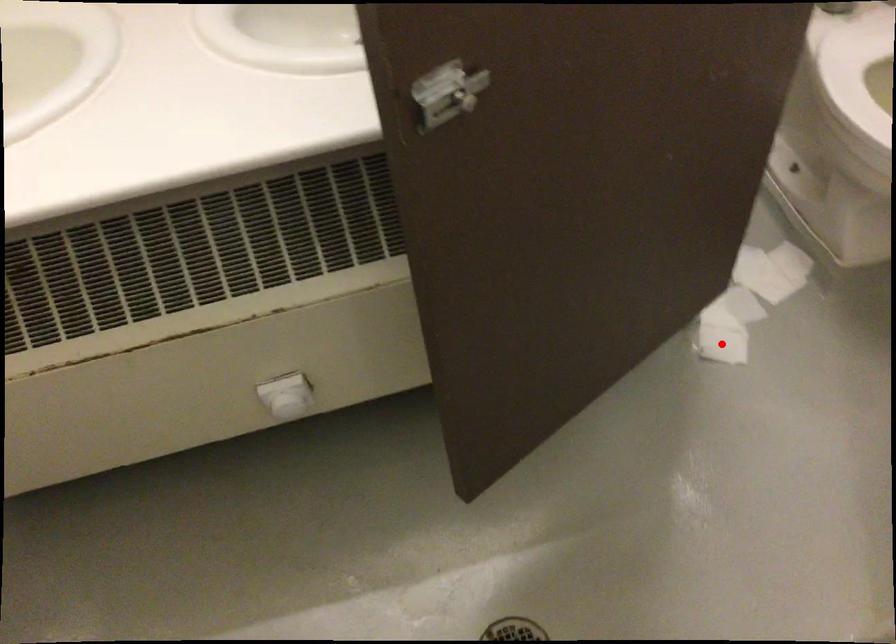
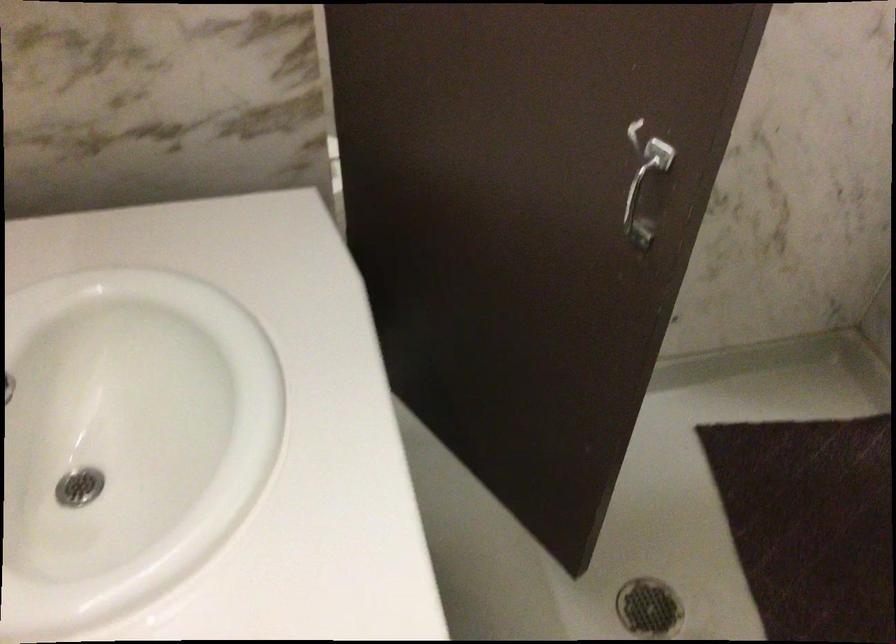
Question: I am providing you with two images of the same scene from different viewpoints. A red point is marked on the first image. At the location where the point appears in image 1, is it still visible in image 2?

Choices:
 (A) Yes
 (B) No

Answer: (B)